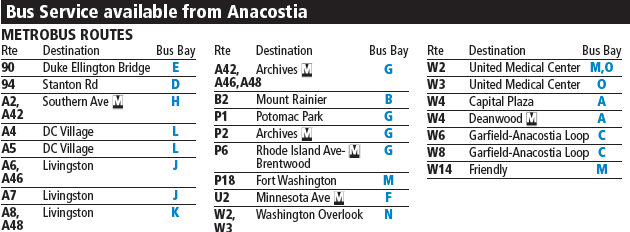
What are the coordinates of `bar black` in the screenshot? It's located at (397, 13).